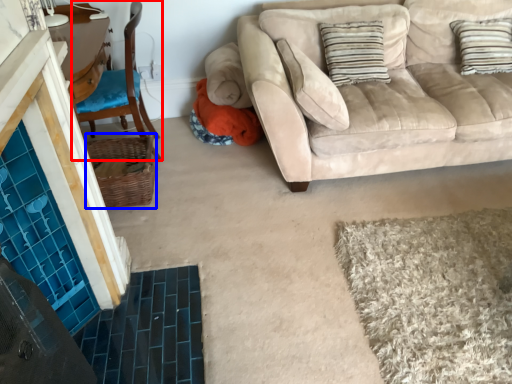
Question: Which object appears closest to the camera in this image, chair (highlighted by a red box) or basket (highlighted by a blue box)?

Choices:
 (A) chair
 (B) basket

Answer: (A)